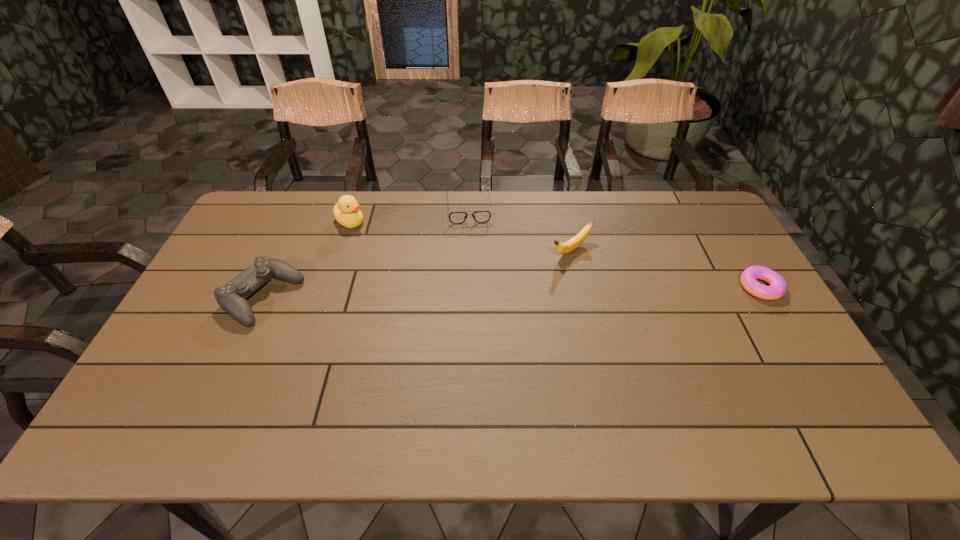
You are a GUI agent. You are given a task and a screenshot of the screen. Output one action in this format:
    pyautogui.click(x=<x>, y=<y>)
    Task: Click on the vacant space at the far right corner of the desktop
    
    Given the screenshot: What is the action you would take?
    pyautogui.click(x=662, y=199)

At what (x,y) coordinates should I click in order to perform the action: click on blank region between the duckling and the shortest object. Please return your answer as a coordinate pair (x, y). The height and width of the screenshot is (540, 960). Looking at the image, I should click on (555, 254).

In order to click on free space that is in between the control and the duckling in this screenshot , I will do `click(307, 260)`.

Identify the location of free space between the second object from right to left and the third object from left to right. (520, 230).

Locate an element on the screen. The height and width of the screenshot is (540, 960). unoccupied position between the third tallest object and the third farthest object is located at coordinates (417, 274).

Find the location of `free space that is in between the third nearest object and the duckling`. free space that is in between the third nearest object and the duckling is located at coordinates (461, 236).

Find the location of a particular element. This screenshot has height=540, width=960. empty location between the fourth tallest object and the control is located at coordinates (366, 253).

This screenshot has height=540, width=960. I want to click on free space that is in between the second object from left to right and the control, so click(307, 260).

The height and width of the screenshot is (540, 960). What are the coordinates of `vacant space in between the third object from right to left and the banana` in the screenshot? It's located at (520, 230).

This screenshot has width=960, height=540. What are the coordinates of `empty space between the fourth tallest object and the control` in the screenshot? It's located at (366, 253).